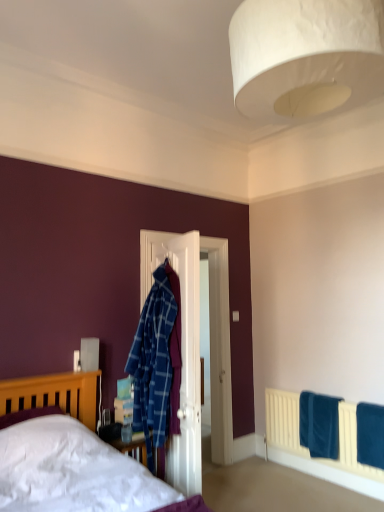
Question: From a real-world perspective, is white wooden door at center physically below blue soft towel at lower right, the second bath towel viewed from the front?

Choices:
 (A) yes
 (B) no

Answer: (B)

Question: From a real-world perspective, is white wooden door at center positioned over blue soft towel at lower right, which appears as the 1th bath towel when viewed from the back, based on gravity?

Choices:
 (A) yes
 (B) no

Answer: (A)

Question: Is white wooden door at center in front of blue soft towel at lower right, acting as the first bath towel starting from the left?

Choices:
 (A) yes
 (B) no

Answer: (A)

Question: Is blue soft towel at lower right, acting as the first bath towel starting from the left, at the back of white wooden door at center?

Choices:
 (A) yes
 (B) no

Answer: (B)

Question: Is white wooden door at center shorter than blue soft towel at lower right, which appears as the 1th bath towel when viewed from the back?

Choices:
 (A) no
 (B) yes

Answer: (A)

Question: From the image's perspective, does white wooden door at center appear lower than blue soft towel at lower right, acting as the first bath towel starting from the left?

Choices:
 (A) yes
 (B) no

Answer: (B)

Question: From a real-world perspective, is white paper lampshade at upper center over blue soft towel at lower right, which appears as the 1th bath towel when viewed from the back?

Choices:
 (A) yes
 (B) no

Answer: (A)

Question: Does white paper lampshade at upper center lie in front of blue soft towel at lower right, the second bath towel viewed from the front?

Choices:
 (A) yes
 (B) no

Answer: (A)

Question: Is white paper lampshade at upper center far away from blue soft towel at lower right, acting as the first bath towel starting from the left?

Choices:
 (A) yes
 (B) no

Answer: (A)

Question: Is white paper lampshade at upper center positioned beyond the bounds of blue soft towel at lower right, which is the second bath towel in right-to-left order?

Choices:
 (A) no
 (B) yes

Answer: (B)

Question: Can you confirm if white paper lampshade at upper center is shorter than blue soft towel at lower right, acting as the first bath towel starting from the left?

Choices:
 (A) yes
 (B) no

Answer: (B)

Question: Considering the relative sizes of white paper lampshade at upper center and blue soft towel at lower right, which appears as the 1th bath towel when viewed from the back, in the image provided, is white paper lampshade at upper center bigger than blue soft towel at lower right, which appears as the 1th bath towel when viewed from the back,?

Choices:
 (A) no
 (B) yes

Answer: (B)

Question: From the image's perspective, is white wooden door at center on top of white paper lampshade at upper center?

Choices:
 (A) no
 (B) yes

Answer: (A)